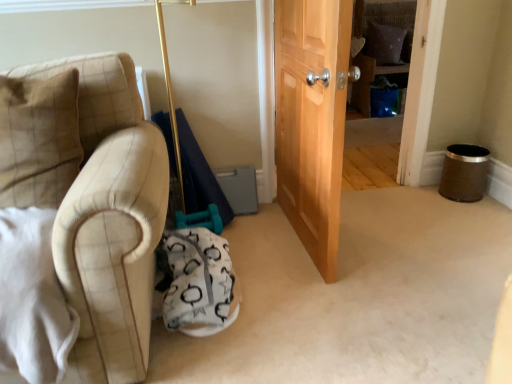
Question: Would you say brown fabric pillow at upper center, which ranks as the second pillow in left-to-right order, is to the left or to the right of white fabric swivel chair at lower center in the picture?

Choices:
 (A) left
 (B) right

Answer: (B)

Question: Considering the positions of brown fabric pillow at upper center, the second pillow from the bottom, and white fabric swivel chair at lower center in the image, is brown fabric pillow at upper center, the second pillow from the bottom, bigger or smaller than white fabric swivel chair at lower center?

Choices:
 (A) small
 (B) big

Answer: (A)

Question: Estimate the real-world distances between objects in this image. Which object is closer to the beige plaid pillow at left, arranged as the second pillow when viewed from the right?

Choices:
 (A) white fabric swivel chair at lower center
 (B) brown fabric pillow at upper center, the first pillow positioned from the top

Answer: (A)

Question: Estimate the real-world distances between objects in this image. Which object is farther from the brown fabric pillow at upper center, the second pillow from the bottom?

Choices:
 (A) beige plaid pillow at left, arranged as the second pillow when viewed from the right
 (B) white fabric swivel chair at lower center

Answer: (A)